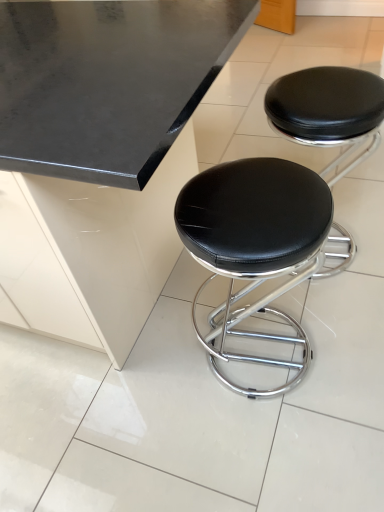
Question: Is black leather stool at center, positioned as the second stool in left-to-right order, taller or shorter than black leather stool at center, positioned as the 2th stool in right-to-left order?

Choices:
 (A) tall
 (B) short

Answer: (A)

Question: Does point (367, 157) appear closer or farther from the camera than point (249, 223)?

Choices:
 (A) closer
 (B) farther

Answer: (B)

Question: From a real-world perspective, relative to black leather stool at center, positioned as the 2th stool in right-to-left order, is black leather stool at center, positioned as the second stool in left-to-right order, vertically above or below?

Choices:
 (A) above
 (B) below

Answer: (B)

Question: Would you say black leather stool at center, positioned as the 2th stool in right-to-left order, is inside or outside black leather stool at center, which ranks as the 1th stool in right-to-left order?

Choices:
 (A) outside
 (B) inside

Answer: (A)

Question: Considering the positions of black leather stool at center, the first stool in the left-to-right sequence, and black leather stool at center, which ranks as the 1th stool in right-to-left order, in the image, is black leather stool at center, the first stool in the left-to-right sequence, taller or shorter than black leather stool at center, which ranks as the 1th stool in right-to-left order,?

Choices:
 (A) tall
 (B) short

Answer: (B)

Question: Looking at the image, does black leather stool at center, the first stool in the left-to-right sequence, seem bigger or smaller compared to black leather stool at center, positioned as the second stool in left-to-right order?

Choices:
 (A) small
 (B) big

Answer: (A)

Question: From a real-world perspective, is black leather stool at center, the first stool in the left-to-right sequence, positioned above or below black leather stool at center, which ranks as the 1th stool in right-to-left order?

Choices:
 (A) above
 (B) below

Answer: (A)